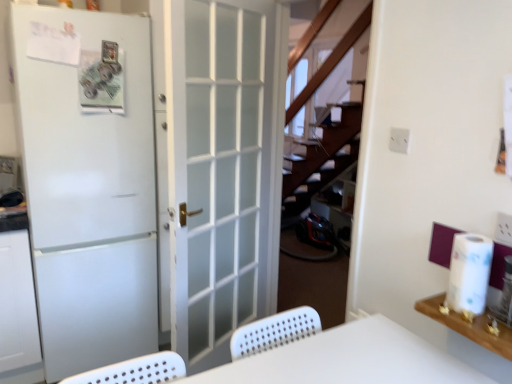
Question: Does white wood shelf at upper right have a larger size compared to white frosted glass door at center, the first door from the right?

Choices:
 (A) no
 (B) yes

Answer: (A)

Question: Is white wood shelf at upper right closer to the viewer compared to white frosted glass door at center, arranged as the 2th door when viewed from the left?

Choices:
 (A) no
 (B) yes

Answer: (B)

Question: Considering the relative sizes of white wood shelf at upper right and white frosted glass door at center, arranged as the 2th door when viewed from the left, in the image provided, is white wood shelf at upper right wider than white frosted glass door at center, arranged as the 2th door when viewed from the left,?

Choices:
 (A) yes
 (B) no

Answer: (A)

Question: Is white wood shelf at upper right aimed at white frosted glass door at center, arranged as the 2th door when viewed from the left?

Choices:
 (A) yes
 (B) no

Answer: (B)

Question: From the image's perspective, is white wood shelf at upper right on white frosted glass door at center, arranged as the 2th door when viewed from the left?

Choices:
 (A) yes
 (B) no

Answer: (B)

Question: Considering the positions of white paper at right and white plastic table at center in the image, is white paper at right bigger or smaller than white plastic table at center?

Choices:
 (A) big
 (B) small

Answer: (B)

Question: Is white paper at right to the left or to the right of white plastic table at center in the image?

Choices:
 (A) right
 (B) left

Answer: (A)

Question: From the image's perspective, is white paper at right located above or below white plastic table at center?

Choices:
 (A) below
 (B) above

Answer: (B)

Question: Is point (476, 269) positioned closer to the camera than point (240, 370)?

Choices:
 (A) closer
 (B) farther

Answer: (B)

Question: Relative to white plastic table at center, is white wood shelf at upper right in front or behind?

Choices:
 (A) behind
 (B) front

Answer: (A)

Question: Based on their sizes in the image, would you say white wood shelf at upper right is bigger or smaller than white plastic table at center?

Choices:
 (A) big
 (B) small

Answer: (B)

Question: Is point (458, 317) closer or farther from the camera than point (330, 372)?

Choices:
 (A) closer
 (B) farther

Answer: (B)

Question: From a real-world perspective, is white wood shelf at upper right physically located above or below white plastic table at center?

Choices:
 (A) below
 (B) above

Answer: (B)

Question: Is point (369, 324) closer or farther from the camera than point (455, 284)?

Choices:
 (A) closer
 (B) farther

Answer: (B)

Question: Is white plastic table at center in front of or behind white paper at right in the image?

Choices:
 (A) behind
 (B) front

Answer: (B)